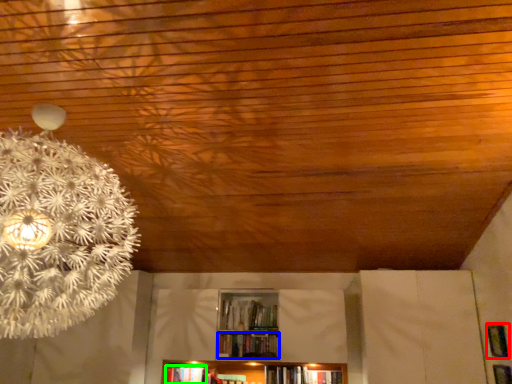
Question: Which object is the closest to the panel (highlighted by a red box)? Choose among these: book (highlighted by a blue box) or book (highlighted by a green box).

Choices:
 (A) book
 (B) book

Answer: (A)